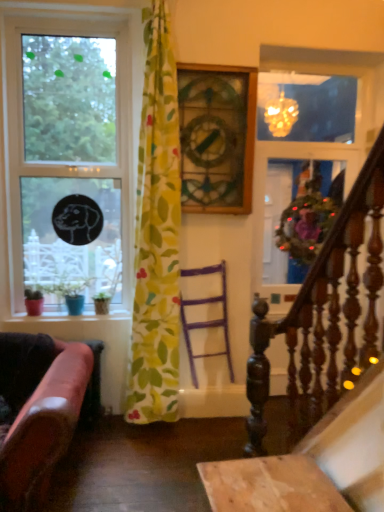
Question: Considering the positions of yellow floral fabric at center and decorative wreath at upper right in the image, is yellow floral fabric at center wider or thinner than decorative wreath at upper right?

Choices:
 (A) thin
 (B) wide

Answer: (B)

Question: Based on their sizes in the image, would you say yellow floral fabric at center is bigger or smaller than decorative wreath at upper right?

Choices:
 (A) big
 (B) small

Answer: (A)

Question: Which object is the farthest from the clear glass window at left?

Choices:
 (A) leather at left
 (B) purple wood chair at center
 (C) decorative wreath at upper right
 (D) dark wood railing at right
 (E) yellow floral fabric at center

Answer: (D)

Question: Considering the real-world distances, which object is closest to the dark wood railing at right?

Choices:
 (A) yellow floral fabric at center
 (B) leather at left
 (C) clear glass window at left
 (D) purple wood chair at center
 (E) decorative wreath at upper right

Answer: (A)